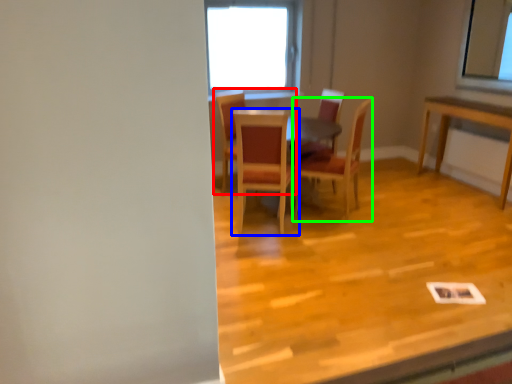
Question: Which object is positioned farthest from chair (highlighted by a red box)? Select from chair (highlighted by a blue box) and chair (highlighted by a green box).

Choices:
 (A) chair
 (B) chair

Answer: (B)